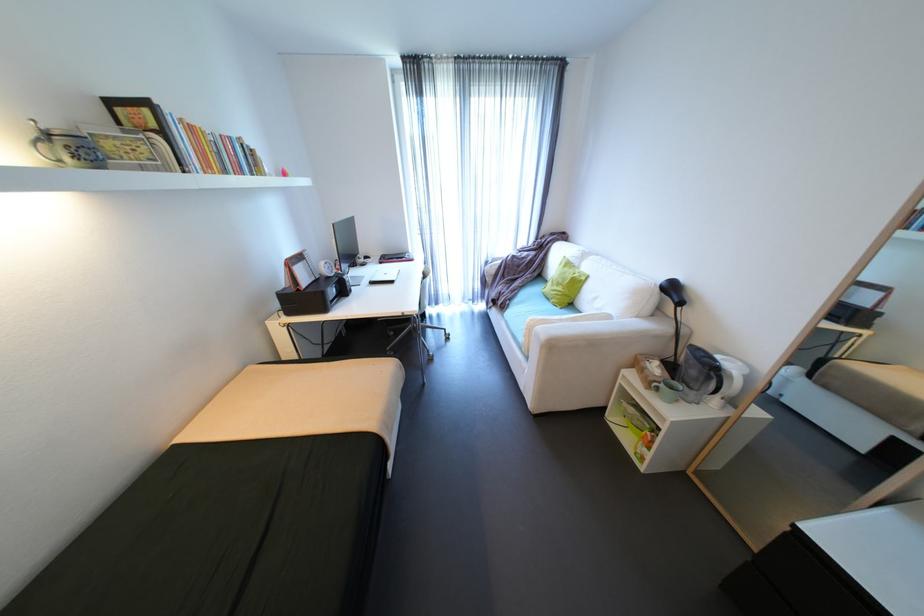
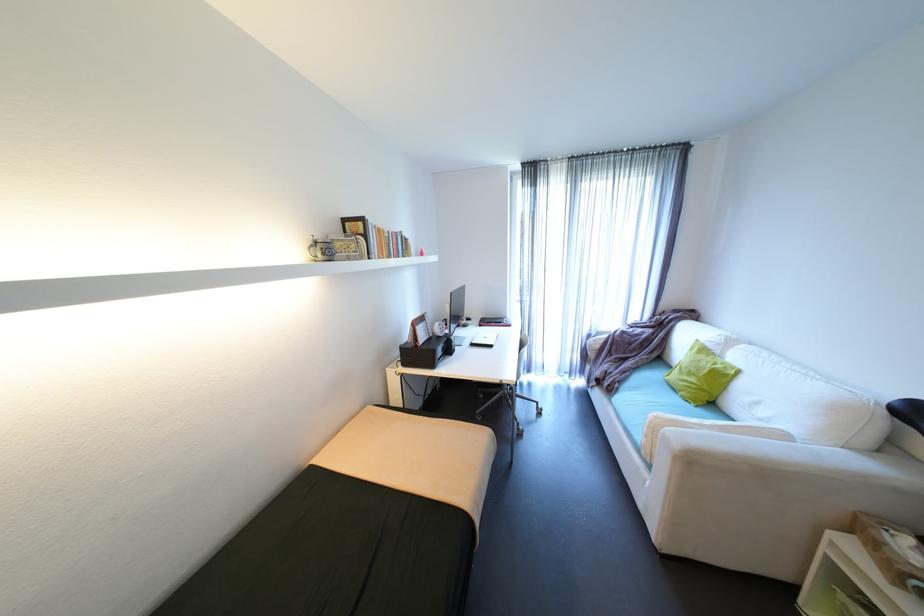
Find the pixel in the second image that matches (x=198, y=168) in the first image.

(380, 254)